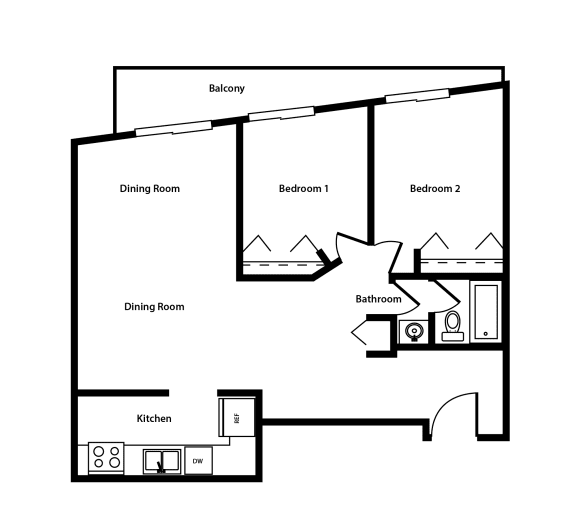
Image resolution: width=576 pixels, height=518 pixels. Find the location of `bathroom`. bathroom is located at coordinates (430, 297).